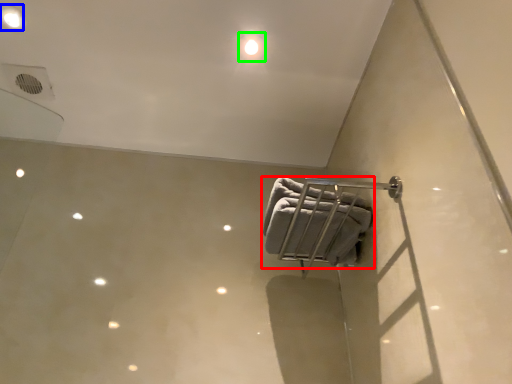
Question: Which object is positioned farthest from towel (highlighted by a red box)? Select from dot (highlighted by a blue box) and dot (highlighted by a green box).

Choices:
 (A) dot
 (B) dot

Answer: (A)